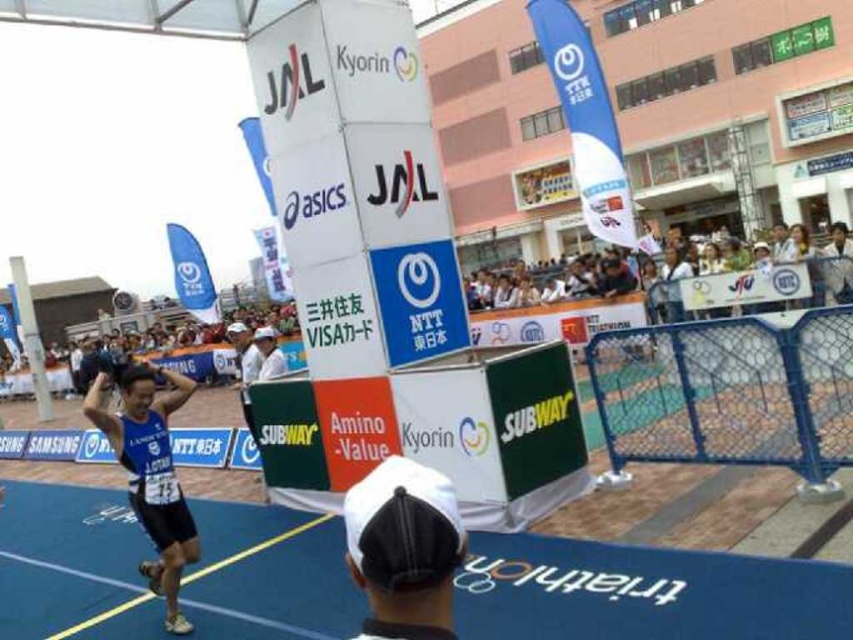
Which is behind, point (381, 612) or point (241, 396)?

Point (241, 396)

Where is `white matte cap at lower center`? white matte cap at lower center is located at coordinates (404, 547).

Is point (374, 604) less distant than point (241, 378)?

That is True.

Locate an element on the screen. The width and height of the screenshot is (853, 640). white matte cap at lower center is located at coordinates (404, 547).

Which is more to the right, white matte cap at lower center or blue fabric jersey at left?

From the viewer's perspective, white matte cap at lower center appears more on the right side.

Between white matte cap at lower center and blue fabric jersey at left, which one has more height?

blue fabric jersey at left

Which is in front, point (347, 561) or point (126, 440)?

Point (347, 561) is more forward.

Identify the location of white matte cap at lower center. The height and width of the screenshot is (640, 853). (404, 547).

Can you confirm if blue fabric jersey at left is taller than white fabric shirt at center?

Yes.

Is blue fabric jersey at left further to camera compared to white fabric shirt at center?

No, blue fabric jersey at left is closer to the viewer.

Is point (160, 474) closer to viewer compared to point (238, 342)?

Yes, point (160, 474) is closer to viewer.

What are the coordinates of `blue fabric jersey at left` in the screenshot? It's located at (149, 472).